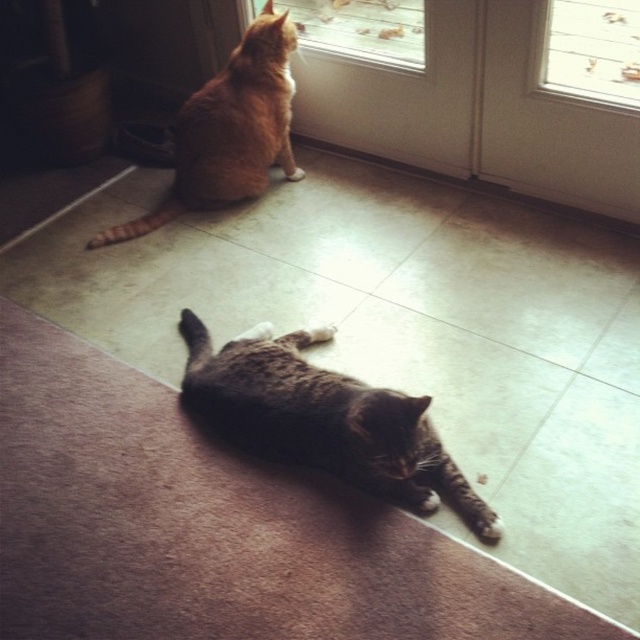
This screenshot has width=640, height=640. What do you see at coordinates (397, 96) in the screenshot?
I see `clear glass screen door at upper center` at bounding box center [397, 96].

Between clear glass screen door at upper center and orange fur cat at upper left, which one has less height?

clear glass screen door at upper center

Describe the element at coordinates (397, 96) in the screenshot. I see `clear glass screen door at upper center` at that location.

Identify the location of clear glass screen door at upper center. (397, 96).

Which is behind, point (227, 403) or point (515, 156)?

The point (515, 156) is behind.

Is gray-furred cat at lower center further to the viewer compared to transparent glass screen door at upper center?

No, it is in front of transparent glass screen door at upper center.

Is point (432, 477) farther from viewer compared to point (552, 124)?

No, (432, 477) is in front of (552, 124).

Find the location of a particular element. This screenshot has width=640, height=640. gray-furred cat at lower center is located at coordinates (326, 419).

Who is positioned more to the left, gray-furred cat at lower center or orange fur cat at upper left?

orange fur cat at upper left is more to the left.

Is point (305, 458) positioned in front of point (288, 76)?

That is True.

Between point (189, 369) and point (244, 90), which one is positioned in front?

Positioned in front is point (189, 369).

You are a GUI agent. You are given a task and a screenshot of the screen. Output one action in this format:
    pyautogui.click(x=<x>, y=<y>)
    Task: Click on the gray-furred cat at lower center
    This screenshot has height=640, width=640.
    Given the screenshot: What is the action you would take?
    pyautogui.click(x=326, y=419)